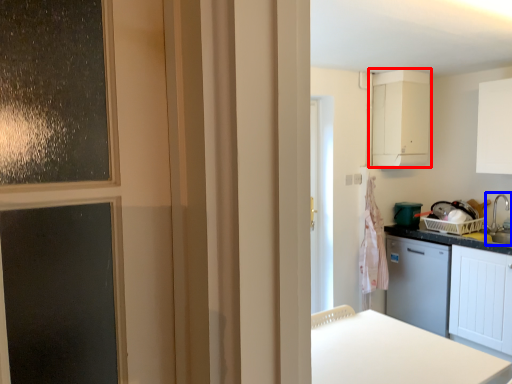
Question: Which object is further to the camera taking this photo, cabinetry (highlighted by a red box) or sink (highlighted by a blue box)?

Choices:
 (A) cabinetry
 (B) sink

Answer: (A)